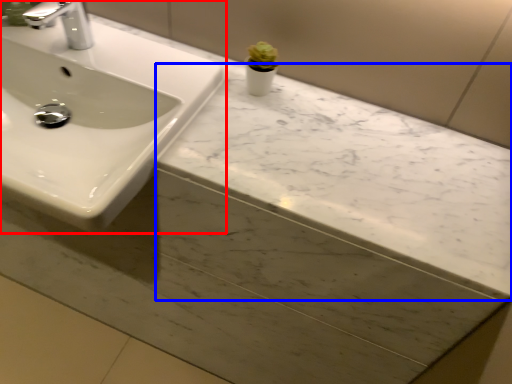
Question: Among these objects, which one is farthest to the camera, sink (highlighted by a red box) or counter top (highlighted by a blue box)?

Choices:
 (A) sink
 (B) counter top

Answer: (B)